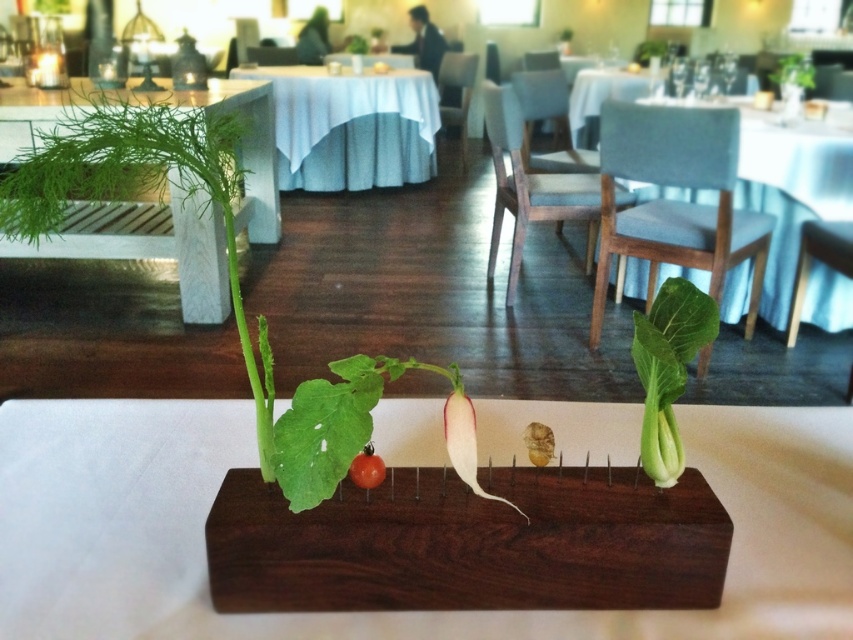
You are a customer sitting at a table in a restaurant. You want to reach the white cloth table at center to grab a napkin. Is the distance too far for you to comfortably reach?

The white cloth table at center is 4.77 meters away from the viewer, which is quite far for a typical reach. You would need to move closer to comfortably grab the napkin.

Where is the dark wood rectangular block at center located in the image?

The dark wood rectangular block at center is located at point (379, 612).

You are a customer at the restaurant and want to place your napkin on the table. Which object would you place it on, the white cloth table at center or the white fabric table at center?

The white cloth table at center is located below the white fabric table at center, so you should place your napkin on the white fabric table at center as it is the upper surface.